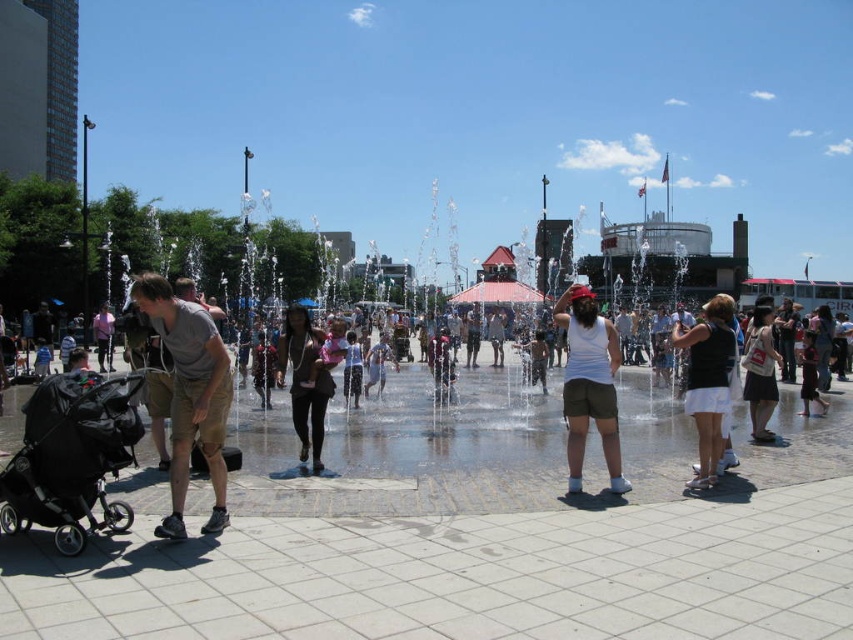
Does black matte stroller at lower left appear on the right side of matte khaki shorts at center?

In fact, black matte stroller at lower left is to the left of matte khaki shorts at center.

Is black matte stroller at lower left taller than matte khaki shorts at center?

Incorrect, black matte stroller at lower left's height is not larger of matte khaki shorts at center's.

Between point (113, 512) and point (221, 483), which one is positioned in front?

Positioned in front is point (113, 512).

You are a GUI agent. You are given a task and a screenshot of the screen. Output one action in this format:
    pyautogui.click(x=<x>, y=<y>)
    Task: Click on the black matte stroller at lower left
    The image size is (853, 640).
    Given the screenshot: What is the action you would take?
    pyautogui.click(x=71, y=458)

Does white matte tank top at center have a greater height compared to dark brown leather jacket at center?

Correct, white matte tank top at center is much taller as dark brown leather jacket at center.

Between point (610, 387) and point (320, 337), which one is positioned behind?

The point (320, 337) is more distant.

Which is behind, point (598, 397) or point (305, 328)?

Positioned behind is point (305, 328).

Identify the location of white matte tank top at center. This screenshot has width=853, height=640. (589, 384).

What do you see at coordinates (306, 380) in the screenshot? Image resolution: width=853 pixels, height=640 pixels. I see `dark brown leather jacket at center` at bounding box center [306, 380].

Where is `dark brown leather jacket at center`? dark brown leather jacket at center is located at coordinates (306, 380).